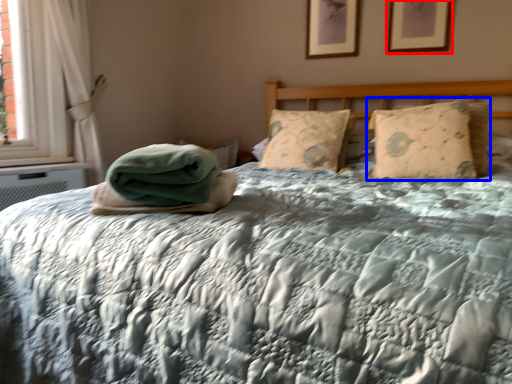
Question: Which of the following is the closest to the observer, picture frame (highlighted by a red box) or pillow (highlighted by a blue box)?

Choices:
 (A) picture frame
 (B) pillow

Answer: (B)